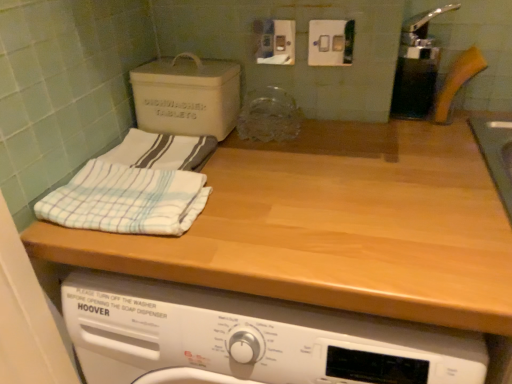
You are a GUI agent. You are given a task and a screenshot of the screen. Output one action in this format:
    pyautogui.click(x=<x>, y=<y>)
    Task: Click on the free spot to the right of white striped cloth at upper left, the second bath towel when ordered from front to back
    This screenshot has height=384, width=512.
    Given the screenshot: What is the action you would take?
    pyautogui.click(x=258, y=158)